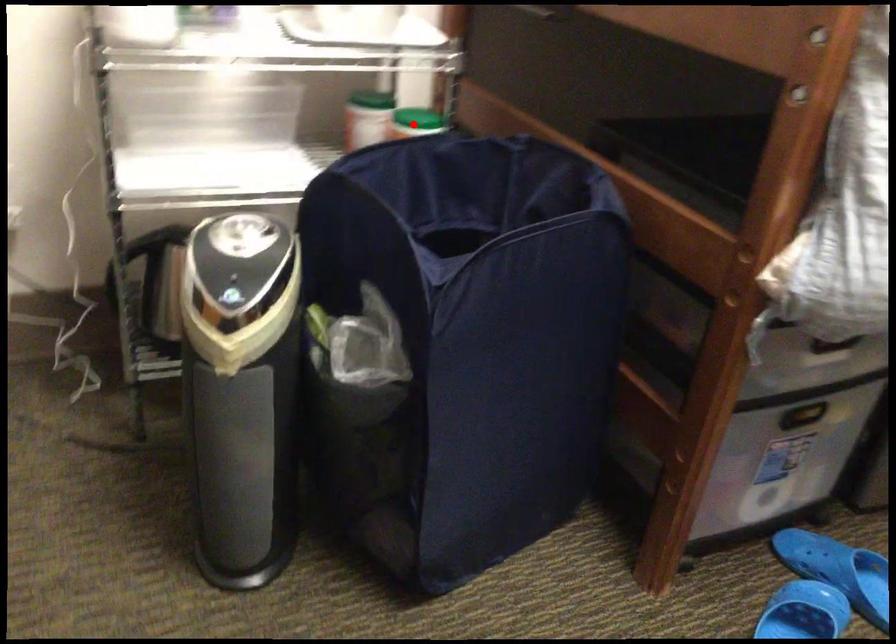
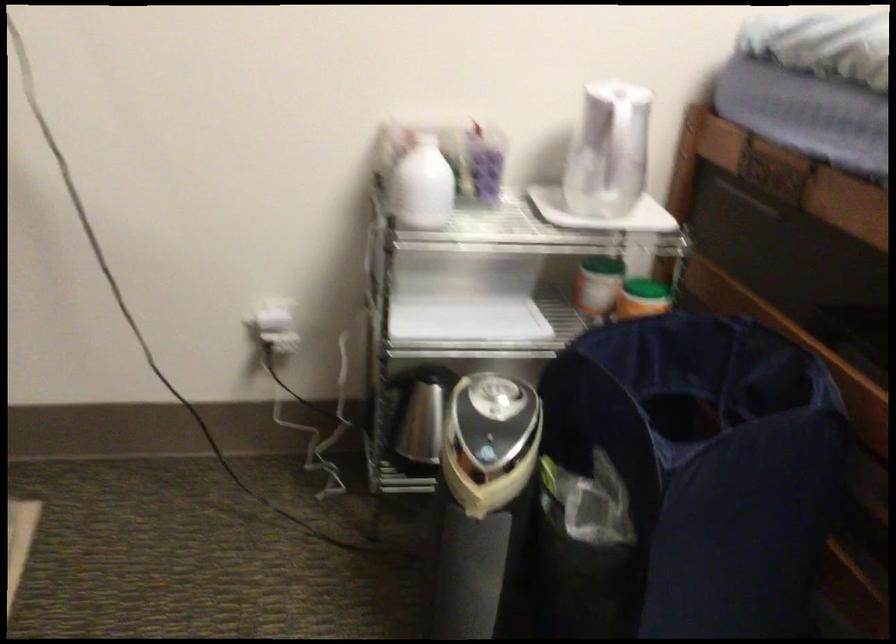
Find the pixel in the second image that matches the highlighted location in the first image.

(642, 298)